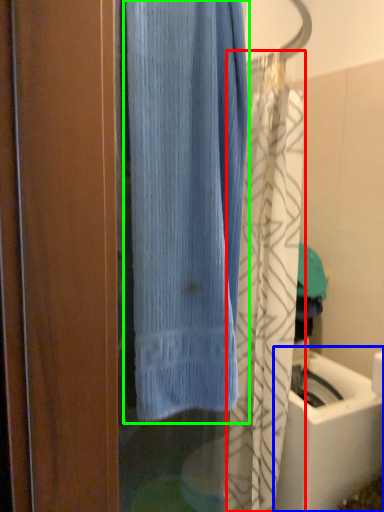
Question: Which is nearer to the shower curtain (highlighted by a red box)? sink (highlighted by a blue box) or curtain (highlighted by a green box).

Choices:
 (A) sink
 (B) curtain

Answer: (A)